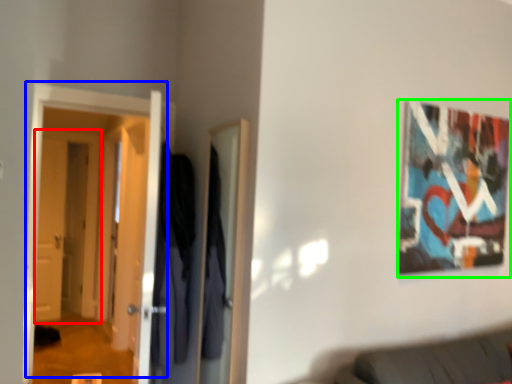
Question: Based on their relative distances, which object is nearer to door (highlighted by a red box)? Choose from door (highlighted by a blue box) and picture frame (highlighted by a green box).

Choices:
 (A) door
 (B) picture frame

Answer: (A)